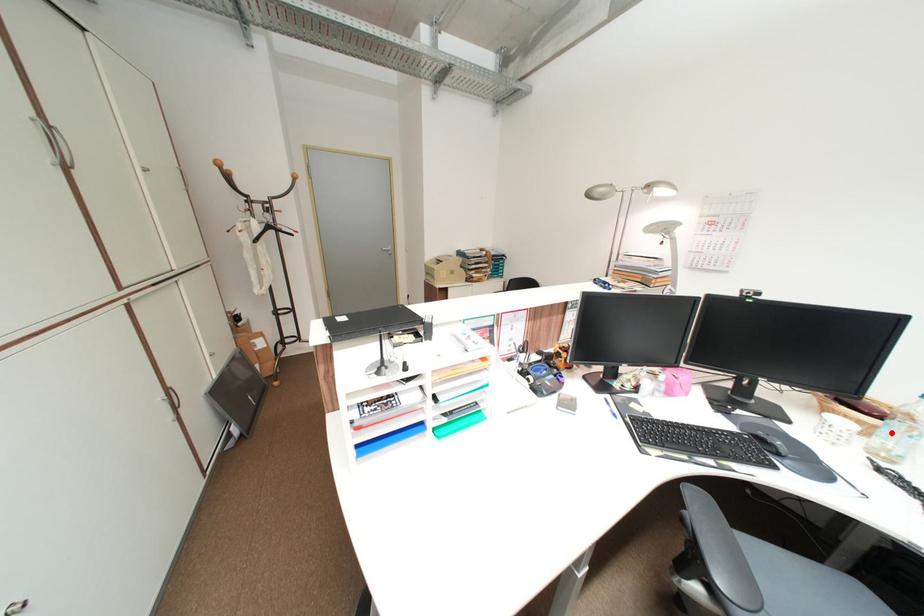
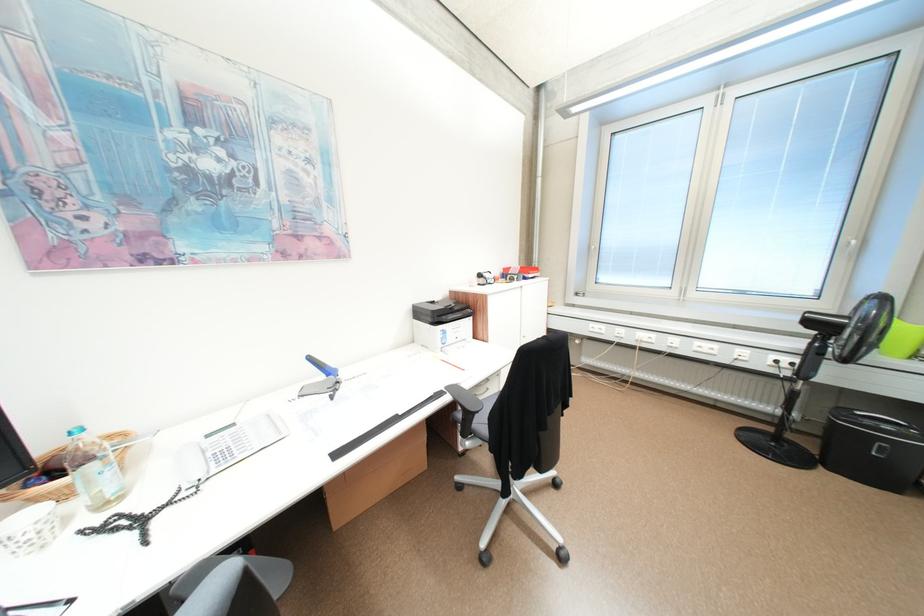
In the second image, find the point that corresponds to the highlighted location in the first image.

(91, 487)